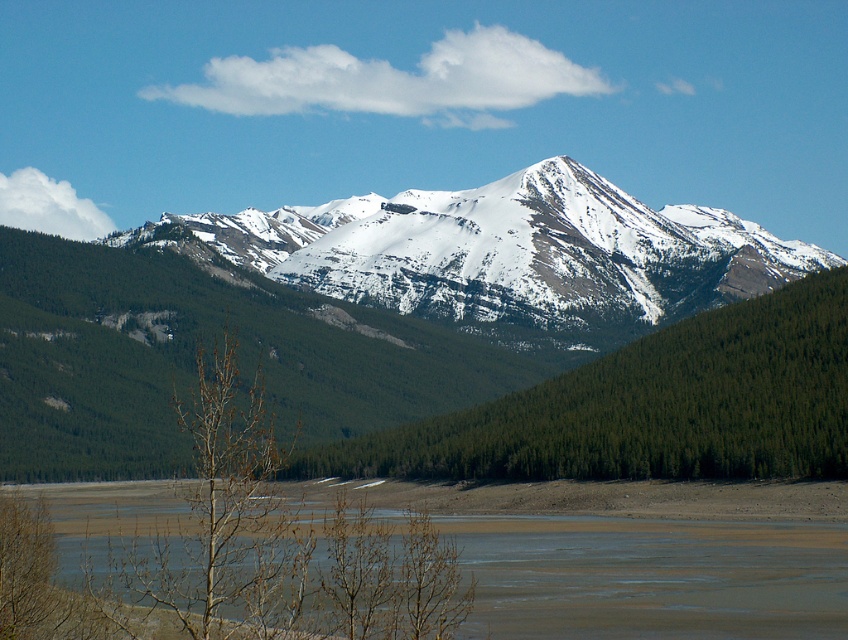
Question: Is green matte tree at center thinner than brown sandy river at lower center?

Choices:
 (A) yes
 (B) no

Answer: (A)

Question: Which object is closer to the camera taking this photo?

Choices:
 (A) snowy rocky mountain at center
 (B) brown sandy river at lower center

Answer: (B)

Question: Among these points, which one is farthest from the camera?

Choices:
 (A) (597, 540)
 (B) (683, 280)

Answer: (B)

Question: Can you confirm if snowy rocky mountain at center is wider than green matte tree at center?

Choices:
 (A) yes
 (B) no

Answer: (A)

Question: Considering the real-world distances, which object is closest to the green matte tree at center?

Choices:
 (A) snowy rocky mountain at center
 (B) brown sandy river at lower center

Answer: (B)

Question: Does snowy rocky mountain at center lie in front of brown sandy river at lower center?

Choices:
 (A) yes
 (B) no

Answer: (B)